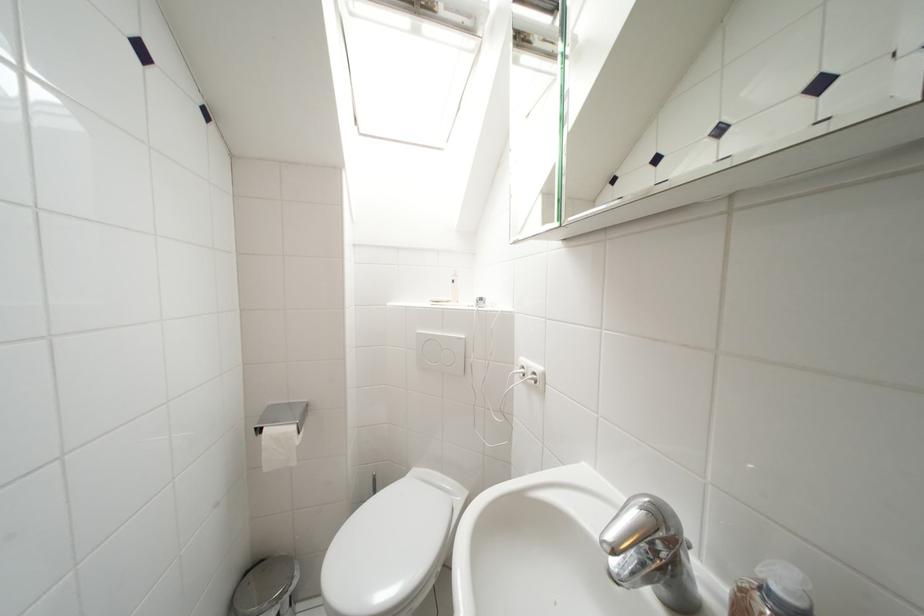
The width and height of the screenshot is (924, 616). What are the coordinates of `mirrored cabinet edge` in the screenshot? It's located at click(x=562, y=108).